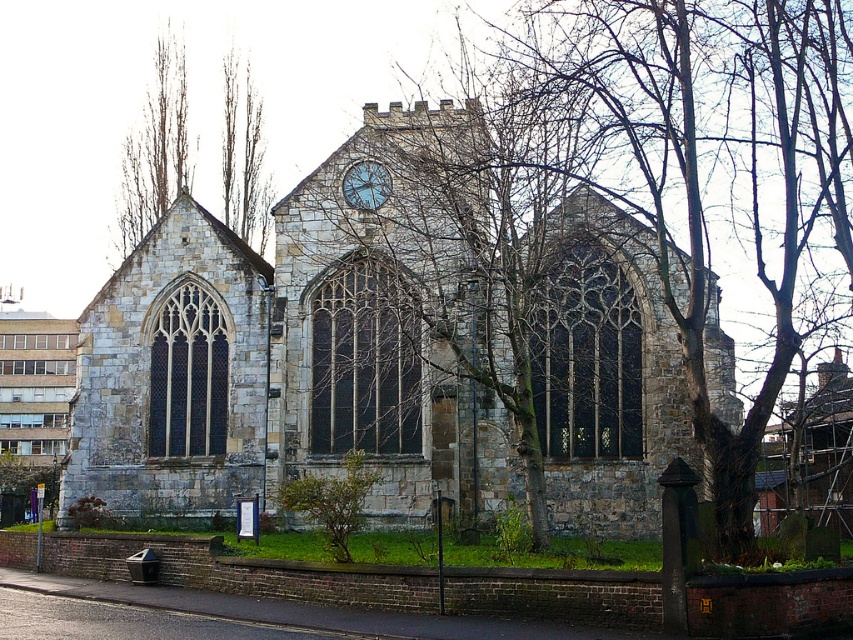
Which is behind, point (186, 189) or point (347, 180)?

The point (186, 189) is behind.

Based on the photo, who is more distant from viewer, (x=152, y=177) or (x=381, y=193)?

Point (x=152, y=177)

This screenshot has width=853, height=640. I want to click on bare wood tree at upper left, so click(x=155, y=147).

Is stone church at center below bare wood tree at upper left?

Yes.

Can you confirm if stone church at center is positioned to the left of bare wood tree at upper left?

No, stone church at center is not to the left of bare wood tree at upper left.

Who is more forward, [437,209] or [126,244]?

Positioned in front is point [437,209].

Where is `stone church at center`? stone church at center is located at coordinates (x=379, y=356).

What do you see at coordinates (379, 356) in the screenshot? This screenshot has width=853, height=640. I see `stone church at center` at bounding box center [379, 356].

Between point (152, 394) and point (341, 193), which one is positioned in front?

Point (341, 193)

Image resolution: width=853 pixels, height=640 pixels. Find the location of `stone church at center`. stone church at center is located at coordinates (x=379, y=356).

You are a GUI agent. You are given a task and a screenshot of the screen. Output one action in this format:
    pyautogui.click(x=<x>, y=<y>)
    Task: Click on the stone church at center
    
    Given the screenshot: What is the action you would take?
    [x=379, y=356]